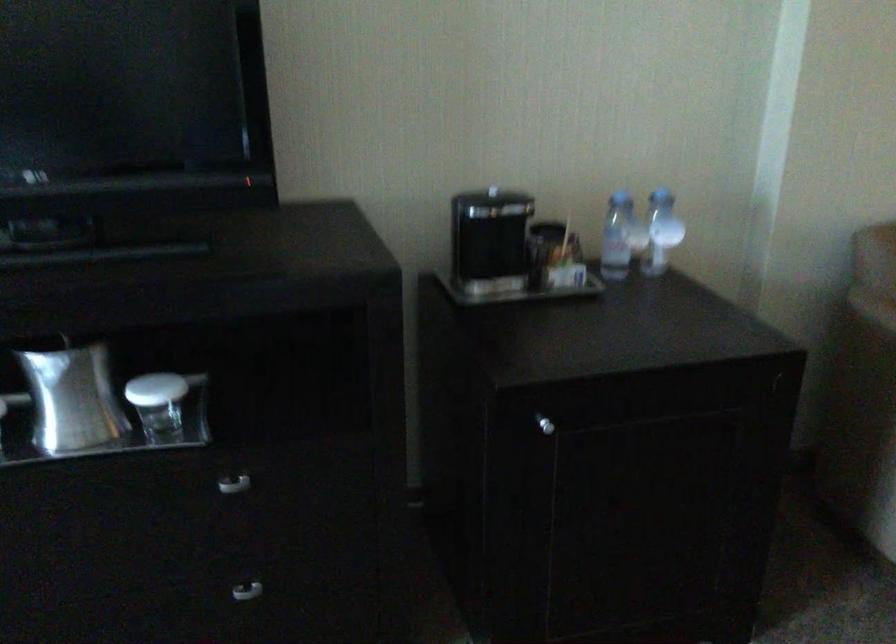
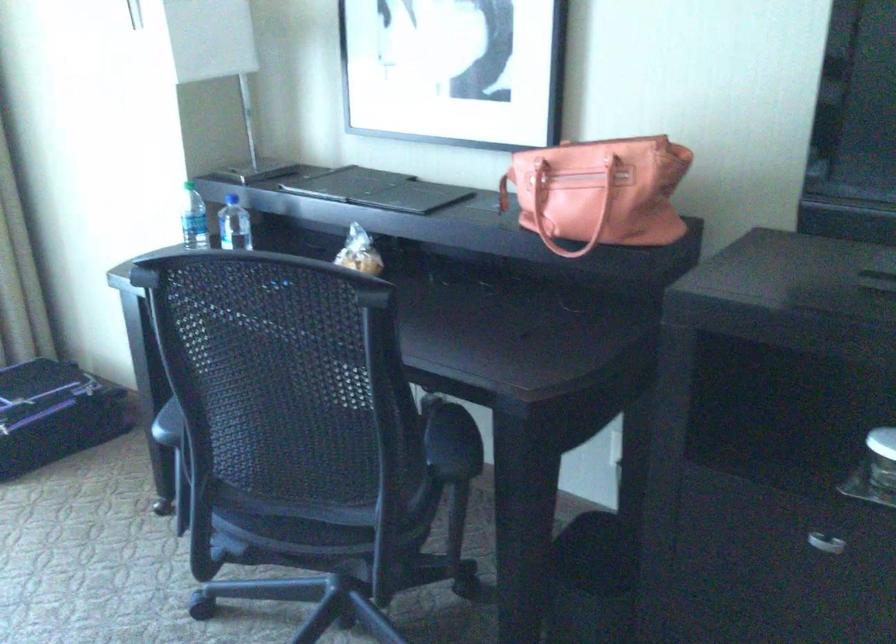
Question: The first image is from the beginning of the video and the second image is from the end. How did the camera likely rotate when shooting the video?

Choices:
 (A) Left
 (B) Right
 (C) Up
 (D) Down

Answer: (A)